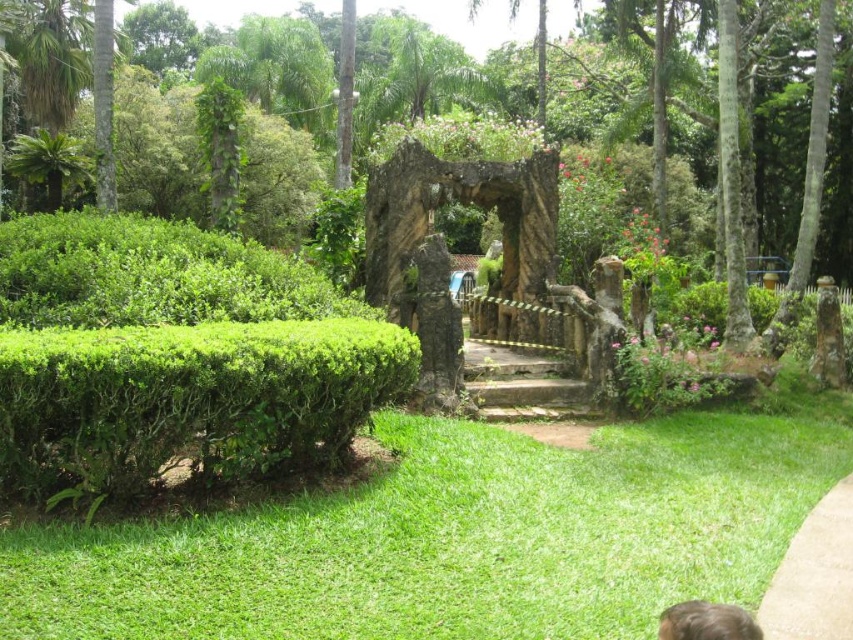
Question: Which point appears farthest from the camera in this image?

Choices:
 (A) (660, 614)
 (B) (515, 369)
 (C) (462, 477)
 (D) (816, 540)

Answer: (B)

Question: Is green leafy hedge at left smaller than concrete at center?

Choices:
 (A) no
 (B) yes

Answer: (A)

Question: Which object appears closest to the camera in this image?

Choices:
 (A) brown hair at lower right
 (B) brown stone stairs at center

Answer: (A)

Question: Can you confirm if green grass at lower center is positioned to the left of green leafy hedge at left?

Choices:
 (A) yes
 (B) no

Answer: (B)

Question: Can you confirm if brown stone stairs at center is wider than brown hair at lower right?

Choices:
 (A) yes
 (B) no

Answer: (A)

Question: Which object is closer to the camera taking this photo?

Choices:
 (A) brown hair at lower right
 (B) green grass at lower center
 (C) green leafy hedge at left
 (D) concrete at center

Answer: (A)